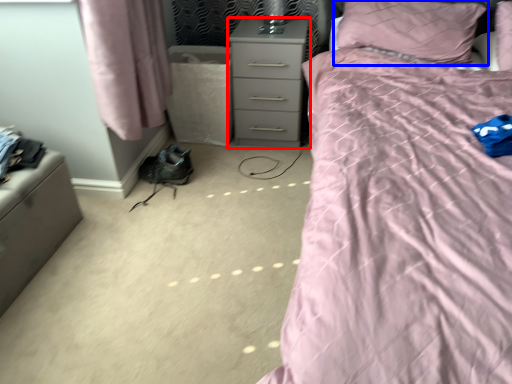
Question: Which of the following is the closest to the observer, nightstand (highlighted by a red box) or pillow (highlighted by a blue box)?

Choices:
 (A) nightstand
 (B) pillow

Answer: (B)